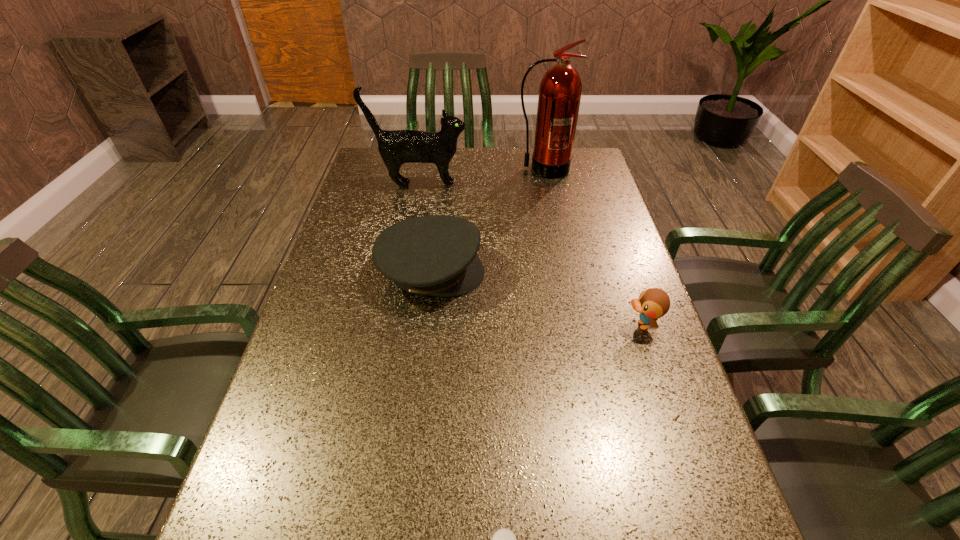
Where is `free space located 0.350m on the front-facing side of the duck`? The height and width of the screenshot is (540, 960). free space located 0.350m on the front-facing side of the duck is located at coordinates (476, 325).

At what (x,y) coordinates should I click in order to perform the action: click on vacant space situated 0.380m on the front-facing side of the duck. Please return your answer as a coordinate pair (x, y). This screenshot has width=960, height=540. Looking at the image, I should click on (464, 325).

The height and width of the screenshot is (540, 960). Find the location of `fire extinguisher at the far edge`. fire extinguisher at the far edge is located at coordinates (560, 89).

Find the location of a particular element. cat at the far edge is located at coordinates (397, 147).

Locate an element on the screen. cat located in the left edge section of the desktop is located at coordinates coord(397,147).

Locate an element on the screen. beret positioned at the left edge is located at coordinates (435, 255).

You are a GUI agent. You are given a task and a screenshot of the screen. Output one action in this format:
    pyautogui.click(x=<x>, y=<y>)
    Task: Click on the fire extinguisher present at the right edge
    The image size is (960, 540).
    Given the screenshot: What is the action you would take?
    pyautogui.click(x=560, y=89)

Locate an element on the screen. duck that is at the right edge is located at coordinates (653, 303).

Locate an element on the screen. The width and height of the screenshot is (960, 540). object that is at the far left corner is located at coordinates (397, 147).

The width and height of the screenshot is (960, 540). In order to click on object that is at the far right corner in this screenshot , I will do `click(560, 89)`.